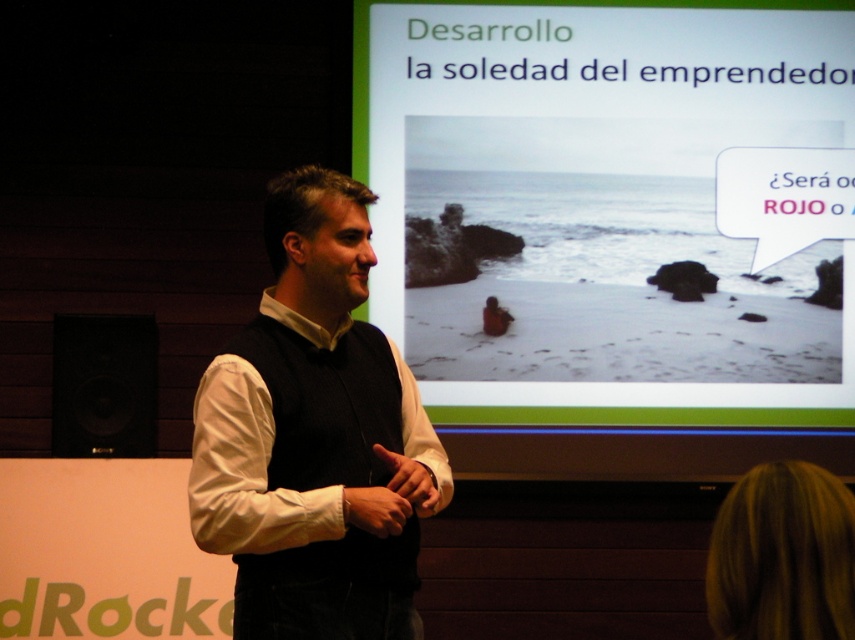
From the picture: Who is taller, matte plastic screen at upper center or white matte vest at center?

matte plastic screen at upper center is taller.

Between matte plastic screen at upper center and white matte vest at center, which one appears on the left side from the viewer's perspective?

From the viewer's perspective, white matte vest at center appears more on the left side.

At what (x,y) coordinates should I click in order to perform the action: click on matte plastic screen at upper center. Please return your answer as a coordinate pair (x, y). Looking at the image, I should click on (618, 228).

Is white matte vest at center to the right of black matte speaker at lower left from the viewer's perspective?

Correct, you'll find white matte vest at center to the right of black matte speaker at lower left.

Who is positioned more to the right, white matte vest at center or black matte speaker at lower left?

Positioned to the right is white matte vest at center.

Identify the location of white matte vest at center. This screenshot has height=640, width=855. (315, 436).

Who is lower down, matte plastic screen at upper center or black matte speaker at lower left?

Positioned lower is black matte speaker at lower left.

Which is behind, point (805, 259) or point (69, 413)?

Point (805, 259)

Does point (391, 216) come farther from viewer compared to point (121, 436)?

That is True.

Find the location of `matte plastic screen at upper center`. matte plastic screen at upper center is located at coordinates pos(618,228).